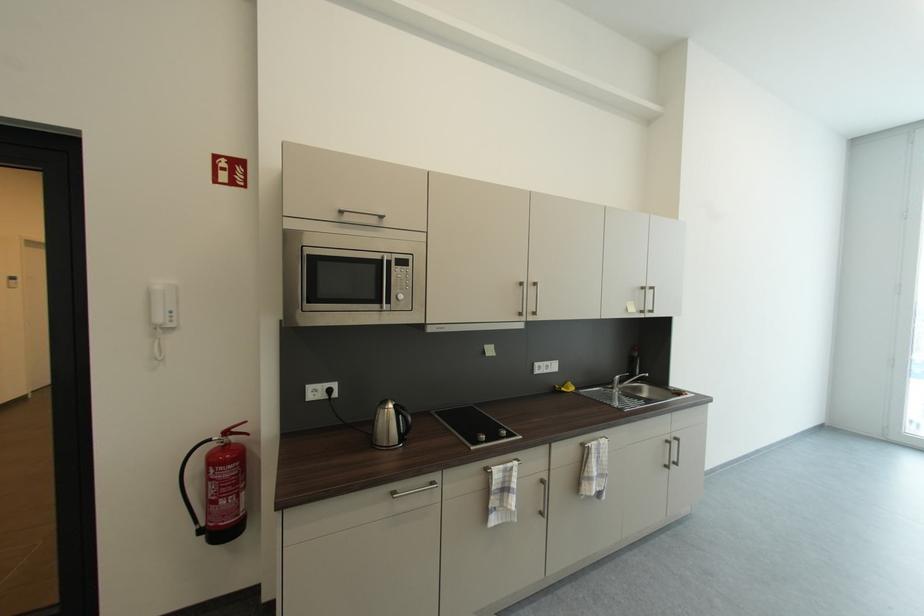
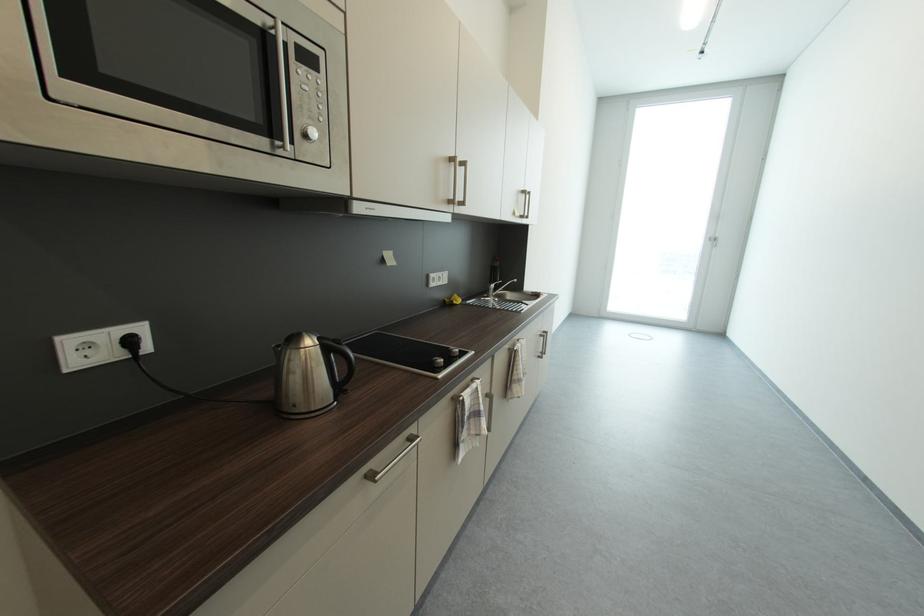
Locate, in the second image, the point that corresponds to the point at 624,379 in the first image.

(499, 286)